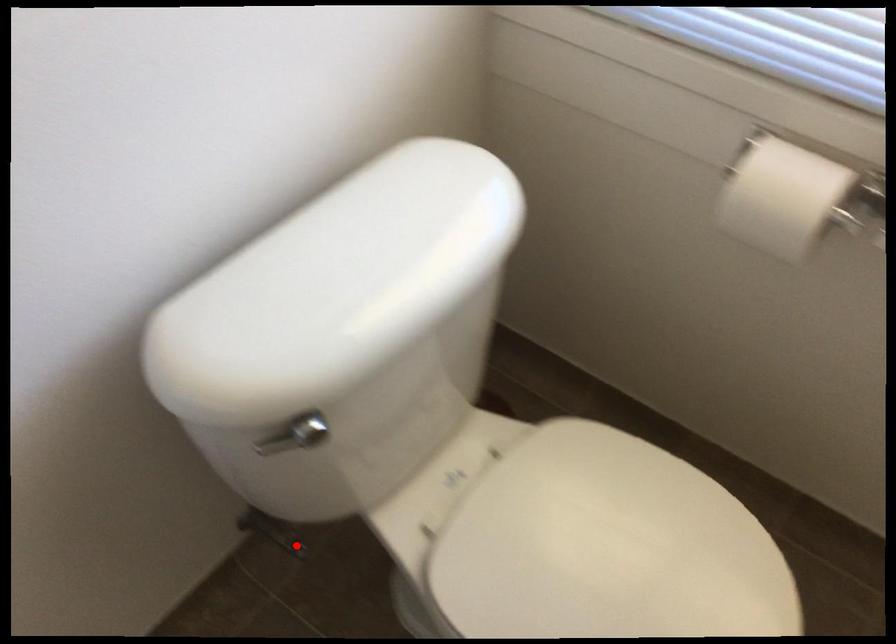
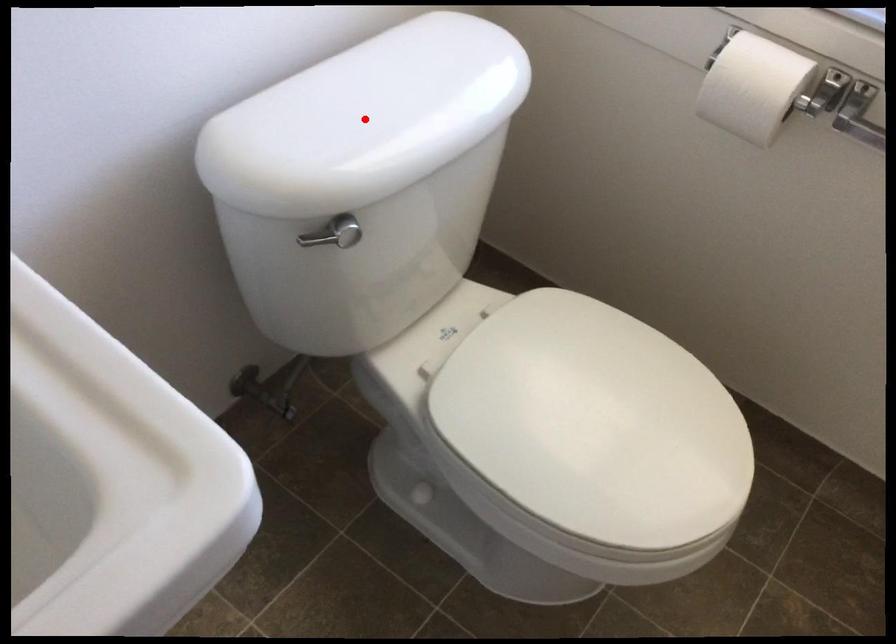
I am providing you with two images of the same scene from different viewpoints. A red point is marked on the first image and another point is marked on the second image. Does the point marked in image1 correspond to the same location as the one in image2?

No